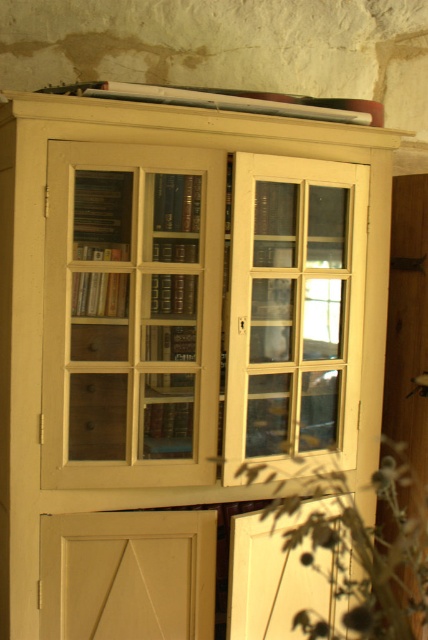
You are organizing books on the vintage cabinet and need to place a new book. The clear glass door at center and the white matte door at lower left are both open. Which door should you approach first if you want to reach the one on the right side first?

The clear glass door at center is to the right of white matte door at lower left, so you should approach the clear glass door at center first to reach the right side door first.

In the scene shown: You are standing in front of the vintage cabinet and notice two points marked on the cabinet. The first point is at coordinate (336, 285) and the second is at (424, 577). Which point is closer to you?

Point (336, 285) is closer to the viewer than point (424, 577).

You are standing in front of the vintage cabinet and want to reach the book on the top shelf. Which door should you open first, the matte wood door at center or the clear glass door at center?

The matte wood door at center is above the clear glass door at center, so you should open the matte wood door at center first to reach the top shelf.